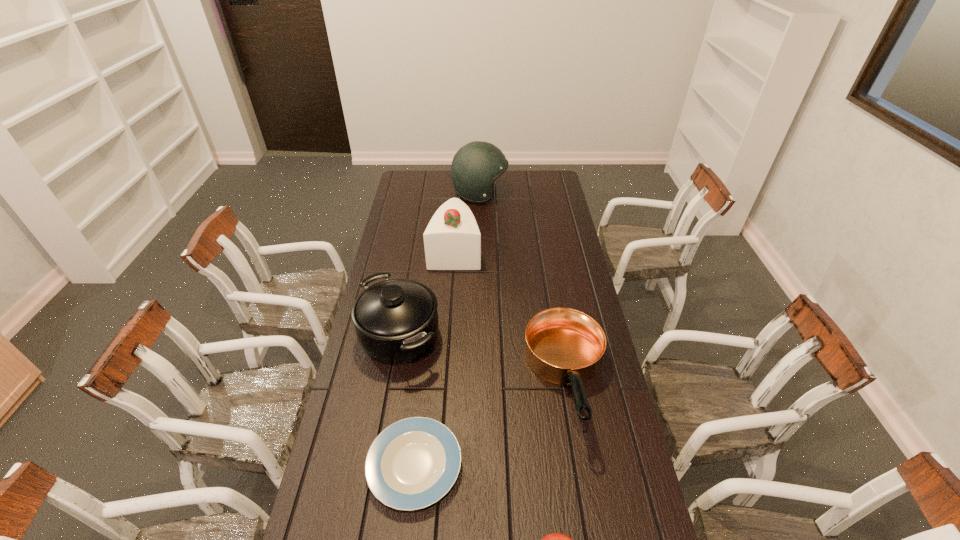
Find the location of a particular element. The image size is (960, 540). the farthest object is located at coordinates (475, 167).

Locate an element on the screen. This screenshot has width=960, height=540. cake is located at coordinates (452, 240).

At what (x,y) coordinates should I click in order to perform the action: click on saucepan. Please return your answer as a coordinate pair (x, y). This screenshot has width=960, height=540. Looking at the image, I should click on (396, 321).

Where is `the third shortest object`? the third shortest object is located at coordinates (x=564, y=346).

I want to click on the shortest object, so click(413, 463).

This screenshot has height=540, width=960. I want to click on free region located 0.280m at the face opening of the farthest object, so click(560, 194).

You are a GUI agent. You are given a task and a screenshot of the screen. Output one action in this format:
    pyautogui.click(x=<x>, y=<y>)
    Task: Click on the vacant space located on the back of the fifth nearest object
    The width and height of the screenshot is (960, 540).
    Given the screenshot: What is the action you would take?
    pyautogui.click(x=459, y=194)

The image size is (960, 540). I want to click on vacant area situated 0.280m on the front of the fourth shortest object, so click(x=378, y=458).

Where is `vacant area situated 0.190m on the handle side of the frying pan`? This screenshot has width=960, height=540. vacant area situated 0.190m on the handle side of the frying pan is located at coordinates [589, 516].

Where is `free space located 0.100m on the back of the plate`? This screenshot has height=540, width=960. free space located 0.100m on the back of the plate is located at coordinates (422, 395).